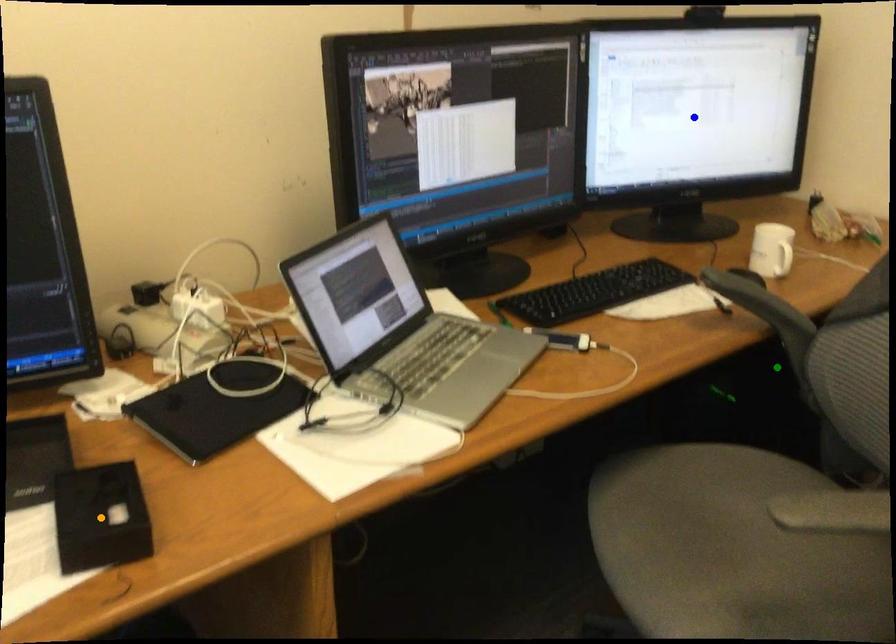
Consider the image. Order these from nearest to farthest:
A) orange point
B) green point
C) blue point

1. orange point
2. green point
3. blue point